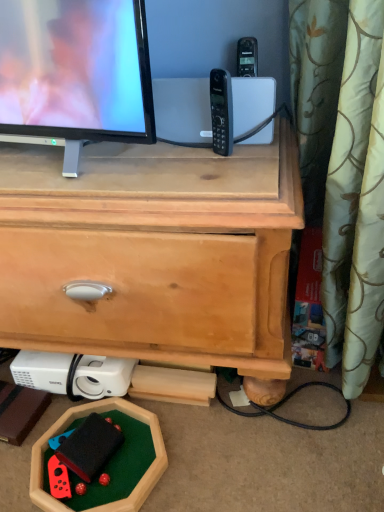
Image resolution: width=384 pixels, height=512 pixels. What do you see at coordinates (152, 252) in the screenshot?
I see `light brown wood chest of drawers at center` at bounding box center [152, 252].

Measure the distance between light brown wood chest of drawers at center and camera.

The depth of light brown wood chest of drawers at center is 26.43 inches.

You are a GUI agent. You are given a task and a screenshot of the screen. Output one action in this format:
    pyautogui.click(x=<x>, y=<y>)
    Task: Click on the rubberized red game controller at lower left
    
    Given the screenshot: What is the action you would take?
    coord(89,448)

Identify the location of black plastic phone at center. This screenshot has height=512, width=384. (221, 111).

How different are the orientations of light brown wood chest of drawers at center and rubberized red game controller at lower left in degrees?

8.03 degrees separate the facing orientations of light brown wood chest of drawers at center and rubberized red game controller at lower left.

Which is in front, point (70, 224) or point (90, 478)?

The point (70, 224) is in front.

Find the location of `the chest of drawers that is above the rubberized red game controller at lower left (from the image's perspective)`. the chest of drawers that is above the rubberized red game controller at lower left (from the image's perspective) is located at coordinates (152, 252).

Based on the photo, based on their positions, is light brown wood chest of drawers at center located to the left or right of rubberized red game controller at lower left?

Based on their positions, light brown wood chest of drawers at center is located to the left of rubberized red game controller at lower left.

From a real-world perspective, is black plastic phone at center on light brown wood chest of drawers at center?

Yes.

Would you consider black plastic phone at center to be distant from light brown wood chest of drawers at center?

black plastic phone at center is near light brown wood chest of drawers at center, not far away.

From the image's perspective, is black plastic phone at center on light brown wood chest of drawers at center?

Yes, from the image's perspective, black plastic phone at center is on top of light brown wood chest of drawers at center.

From a real-world perspective, between light brown wood chest of drawers at center and black plastic phone at center, who is vertically higher?

black plastic phone at center.

Is light brown wood chest of drawers at center smaller than black plastic phone at center?

No, light brown wood chest of drawers at center is not smaller than black plastic phone at center.

Considering the points (100, 220) and (216, 124), which point is behind, point (100, 220) or point (216, 124)?

The point (216, 124) is farther from the camera.

Which of these two, rubberized red game controller at lower left or black plastic phone at center, is wider?

rubberized red game controller at lower left.

Is rubberized red game controller at lower left aimed at black plastic phone at center?

No.

Consider the image. From a real-world perspective, which is physically above, rubberized red game controller at lower left or black plastic phone at center?

black plastic phone at center is physically above.

Can you tell me how much rubberized red game controller at lower left and light brown wood chest of drawers at center differ in facing direction?

The facing directions of rubberized red game controller at lower left and light brown wood chest of drawers at center are 8.03 degrees apart.

Considering the sizes of objects rubberized red game controller at lower left and light brown wood chest of drawers at center in the image provided, who is thinner, rubberized red game controller at lower left or light brown wood chest of drawers at center?

With smaller width is rubberized red game controller at lower left.

Locate an element on the screen. chest of drawers on the left side of rubberized red game controller at lower left is located at coordinates (152, 252).

Which is more distant, (221, 89) or (103, 463)?

The point (221, 89) is more distant.

Is black plastic phone at center to the right of rubberized red game controller at lower left from the viewer's perspective?

Yes.

Considering the sizes of black plastic phone at center and rubberized red game controller at lower left in the image, is black plastic phone at center wider or thinner than rubberized red game controller at lower left?

black plastic phone at center is thinner than rubberized red game controller at lower left.

From a real-world perspective, is black plastic phone at center on top of rubberized red game controller at lower left?

Yes, from a real-world perspective, black plastic phone at center is above rubberized red game controller at lower left.

You are a GUI agent. You are given a task and a screenshot of the screen. Output one action in this format:
    pyautogui.click(x=<x>, y=<y>)
    Task: Click on the toy behind the light brown wood chest of drawers at center
    This screenshot has height=512, width=384.
    Given the screenshot: What is the action you would take?
    pyautogui.click(x=89, y=448)

Where is `gadget above the light brown wood chest of drawers at center (from a real-world perspective)`? gadget above the light brown wood chest of drawers at center (from a real-world perspective) is located at coordinates (221, 111).

When comparing their distances from black plastic phone at center, does light brown wood chest of drawers at center or rubberized red game controller at lower left seem closer?

light brown wood chest of drawers at center is positioned closer to the anchor black plastic phone at center.

Looking at the image, which one is located closer to light brown wood chest of drawers at center, black plastic phone at center or rubberized red game controller at lower left?

black plastic phone at center lies closer to light brown wood chest of drawers at center than the other object.

Based on their spatial positions, is black plastic phone at center or light brown wood chest of drawers at center further from rubberized red game controller at lower left?

black plastic phone at center.

Looking at the image, which one is located closer to light brown wood chest of drawers at center, rubberized red game controller at lower left or black plastic phone at center?

black plastic phone at center lies closer to light brown wood chest of drawers at center than the other object.

Based on the photo, looking at the image, which one is located closer to black plastic phone at center, rubberized red game controller at lower left or light brown wood chest of drawers at center?

Based on the image, light brown wood chest of drawers at center appears to be nearer to black plastic phone at center.

Considering their positions, is light brown wood chest of drawers at center positioned further to rubberized red game controller at lower left than black plastic phone at center?

Among the two, black plastic phone at center is located further to rubberized red game controller at lower left.

Locate an element on the screen. The width and height of the screenshot is (384, 512). the chest of drawers that lies between black plastic phone at center and rubberized red game controller at lower left from top to bottom is located at coordinates (152, 252).